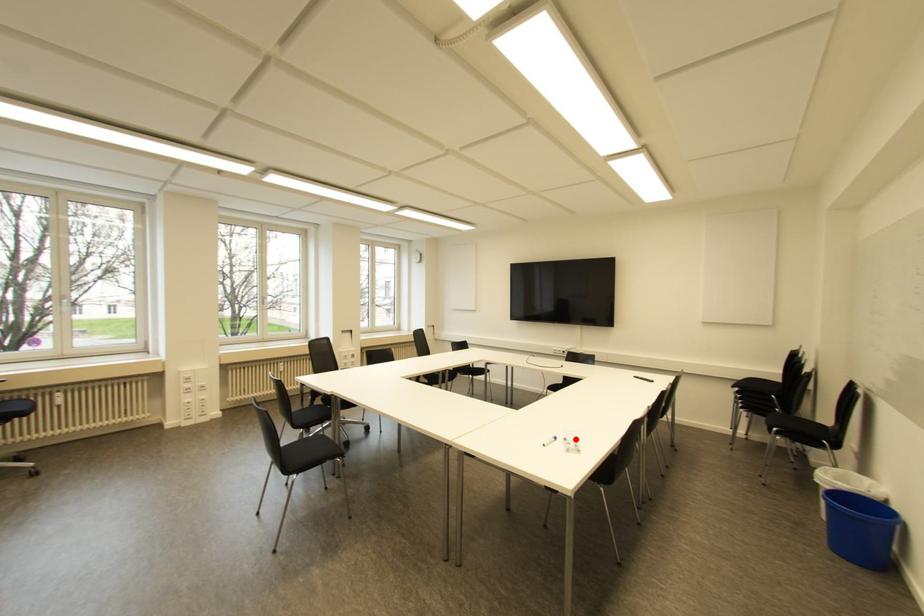
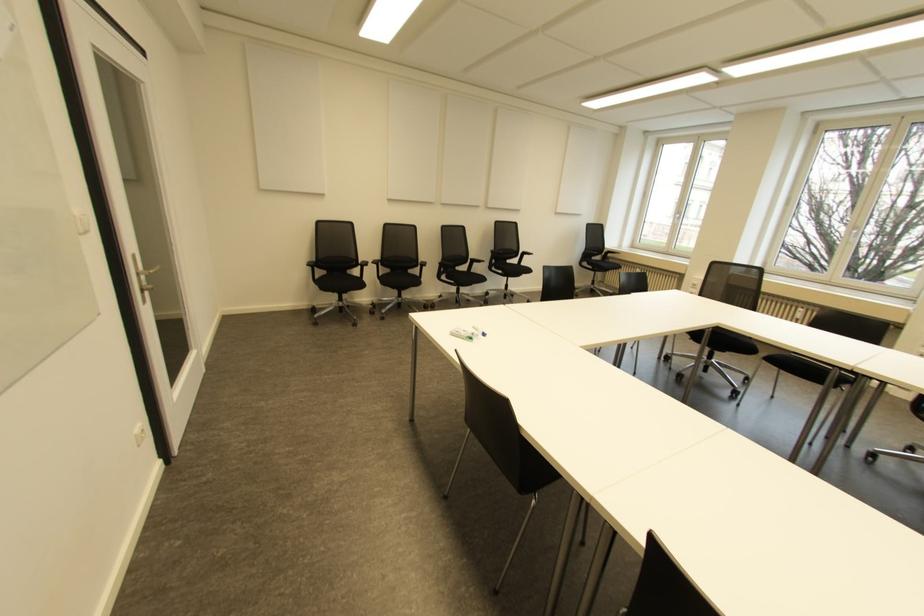
In the second image, find the point that corresponds to the highlighted location in the first image.

(470, 338)